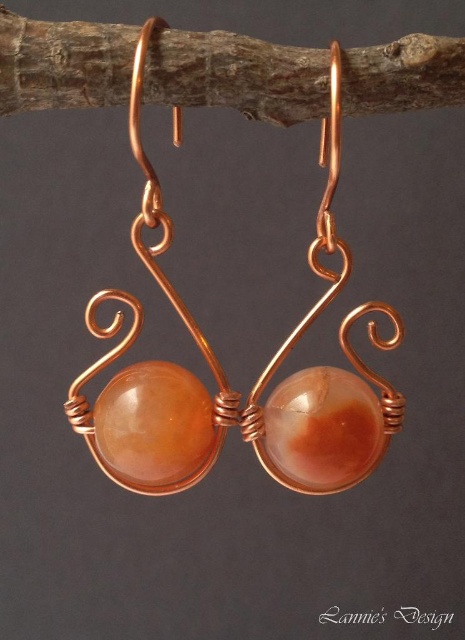
Question: Which of the following is the closest to the observer?

Choices:
 (A) brown wood at upper center
 (B) copper wire wrapped earrings at center

Answer: (B)

Question: Does copper wire wrapped earrings at center have a larger size compared to brown wood at upper center?

Choices:
 (A) no
 (B) yes

Answer: (B)

Question: Is copper wire wrapped earrings at center below brown wood at upper center?

Choices:
 (A) yes
 (B) no

Answer: (A)

Question: Can you confirm if copper wire wrapped earrings at center is positioned above brown wood at upper center?

Choices:
 (A) yes
 (B) no

Answer: (B)